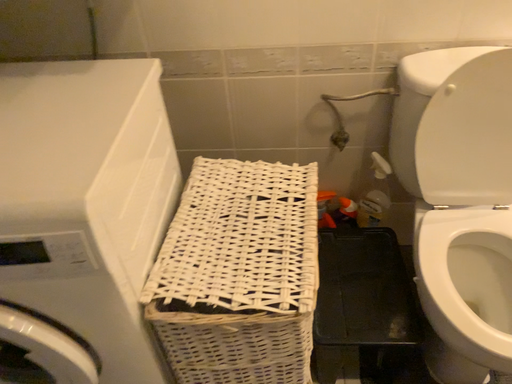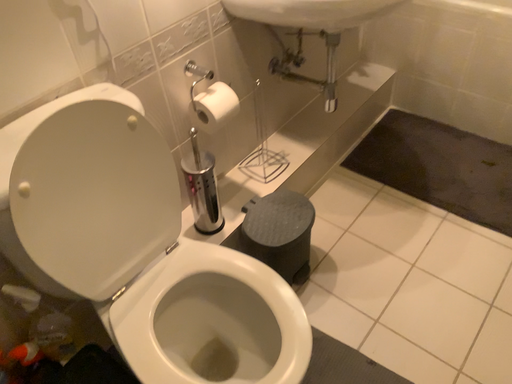
Question: How did the camera likely rotate when shooting the video?

Choices:
 (A) rotated upward
 (B) rotated downward

Answer: (A)